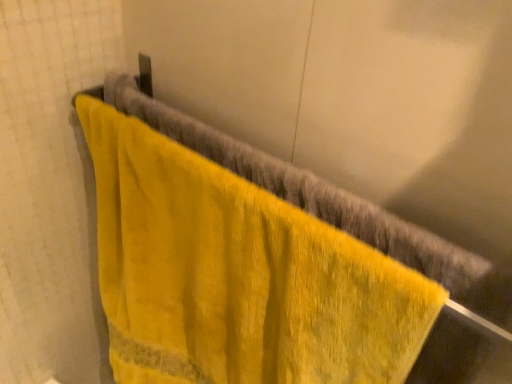
Describe the element at coordinates (237, 275) in the screenshot. Image resolution: width=512 pixels, height=384 pixels. I see `yellow cotton towel at center` at that location.

Where is `yellow cotton towel at center`? This screenshot has width=512, height=384. yellow cotton towel at center is located at coordinates (237, 275).

The height and width of the screenshot is (384, 512). In order to click on yellow cotton towel at center in this screenshot , I will do [x=237, y=275].